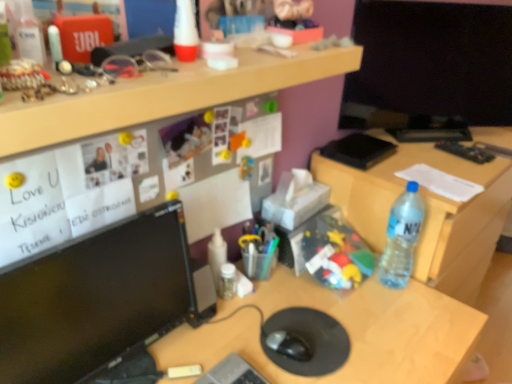
Question: Is translucent plastic bottle at right, marked as the second bottle in a left-to-right arrangement, taller than black glossy monitor at left?

Choices:
 (A) no
 (B) yes

Answer: (A)

Question: Is translucent plastic bottle at right, which appears as the 1th bottle when viewed from the right, positioned in front of black glossy monitor at left?

Choices:
 (A) no
 (B) yes

Answer: (A)

Question: Is translucent plastic bottle at right, marked as the second bottle in a left-to-right arrangement, looking in the opposite direction of black glossy monitor at left?

Choices:
 (A) no
 (B) yes

Answer: (A)

Question: Considering the relative sizes of translucent plastic bottle at right, which appears as the 1th bottle when viewed from the right, and black glossy monitor at left in the image provided, is translucent plastic bottle at right, which appears as the 1th bottle when viewed from the right, shorter than black glossy monitor at left?

Choices:
 (A) no
 (B) yes

Answer: (B)

Question: Can you confirm if translucent plastic bottle at right, which appears as the 1th bottle when viewed from the right, is positioned to the left of black glossy monitor at left?

Choices:
 (A) no
 (B) yes

Answer: (A)

Question: Does point (333, 322) appear closer or farther from the camera than point (241, 139)?

Choices:
 (A) farther
 (B) closer

Answer: (B)

Question: In the image, is black rubber mousepad at center positioned in front of or behind plastic toy at center, marked as the second toy in a back-to-front arrangement?

Choices:
 (A) behind
 (B) front

Answer: (B)

Question: Considering the positions of black rubber mousepad at center and plastic toy at center, which is the 1th toy from top to bottom, in the image, is black rubber mousepad at center taller or shorter than plastic toy at center, which is the 1th toy from top to bottom,?

Choices:
 (A) short
 (B) tall

Answer: (A)

Question: From a real-world perspective, is black rubber mousepad at center physically located above or below plastic toy at center, which is the second toy in bottom-to-top order?

Choices:
 (A) above
 (B) below

Answer: (B)

Question: Considering the positions of black glossy monitor at left and wooden desk at upper center, arranged as the 1th desk when viewed from the top, in the image, is black glossy monitor at left wider or thinner than wooden desk at upper center, arranged as the 1th desk when viewed from the top,?

Choices:
 (A) thin
 (B) wide

Answer: (A)

Question: Is point (157, 326) closer or farther from the camera than point (75, 114)?

Choices:
 (A) farther
 (B) closer

Answer: (A)

Question: Would you say black glossy monitor at left is to the left or to the right of wooden desk at upper center, arranged as the 1th desk when viewed from the top, in the picture?

Choices:
 (A) right
 (B) left

Answer: (B)

Question: In the image, is black glossy monitor at left positioned in front of or behind wooden desk at upper center, arranged as the 1th desk when viewed from the top?

Choices:
 (A) behind
 (B) front

Answer: (A)

Question: Looking at their shapes, would you say black matte notepad at upper right is wider or thinner than matte black monitor at center, acting as the 1th desk starting from the bottom?

Choices:
 (A) thin
 (B) wide

Answer: (A)

Question: Relative to matte black monitor at center, acting as the 1th desk starting from the bottom, is black matte notepad at upper right in front or behind?

Choices:
 (A) behind
 (B) front

Answer: (A)